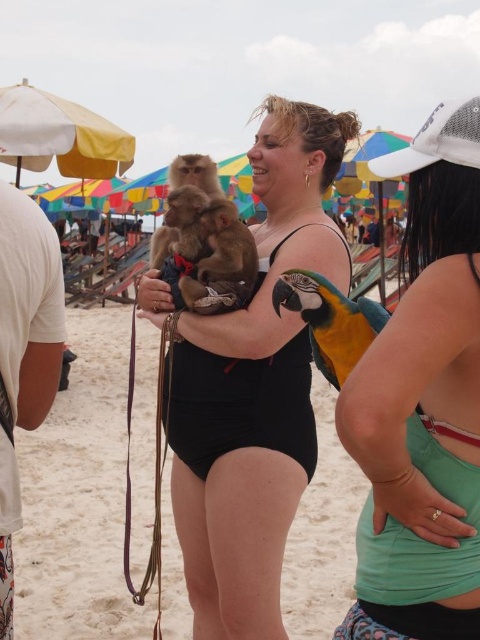
Question: Is black matte swimsuit at center below blue-green macaw at center?

Choices:
 (A) no
 (B) yes

Answer: (B)

Question: Does teal fabric tank top at right appear under yellow fabric umbrella at upper left?

Choices:
 (A) no
 (B) yes

Answer: (B)

Question: Which point is closer to the camera taking this photo?

Choices:
 (A) (444, 508)
 (B) (195, 412)
 (C) (200, 208)

Answer: (A)

Question: Among these points, which one is nearest to the camera?

Choices:
 (A) (120, 154)
 (B) (322, 316)

Answer: (B)

Question: Is yellow fabric umbrella at upper left further to the viewer compared to brown fur monkey at center?

Choices:
 (A) no
 (B) yes

Answer: (B)

Question: Which of these objects is positioned closest to the teal fabric tank top at right?

Choices:
 (A) yellow fabric umbrella at upper left
 (B) blue-green macaw at center
 (C) black matte swimsuit at center

Answer: (B)